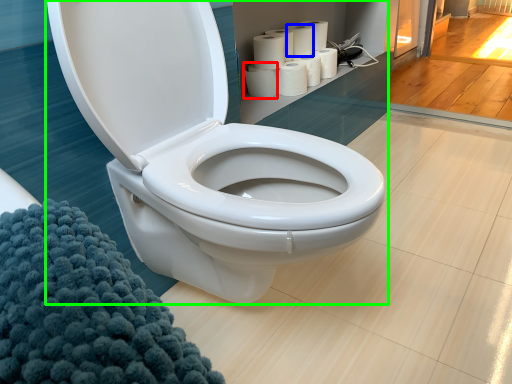
Question: Which object is the farthest from paper towel (highlighted by a red box)? Choose among these: paper towel (highlighted by a blue box) or toilet (highlighted by a green box).

Choices:
 (A) paper towel
 (B) toilet

Answer: (B)